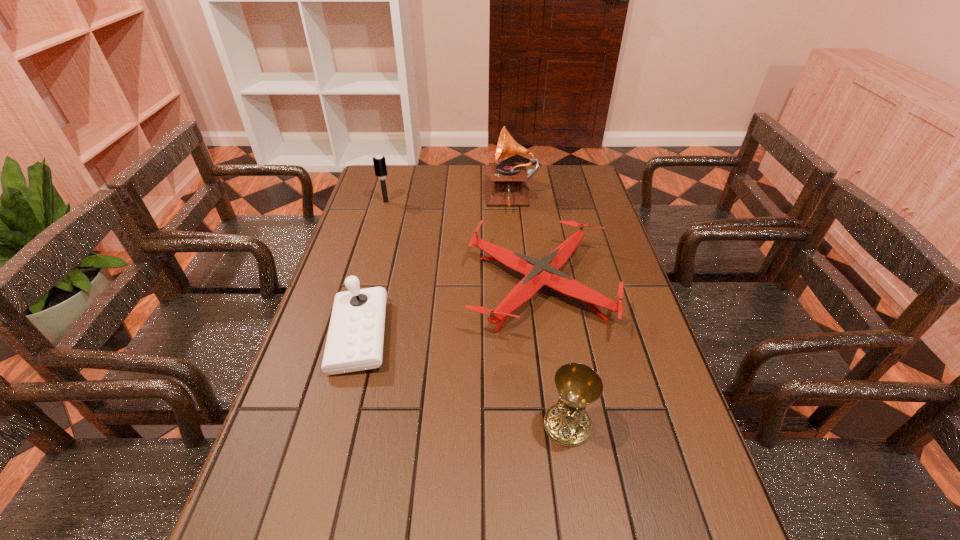
Identify the location of the tallest object. (507, 187).

The image size is (960, 540). In order to click on hairbrush in this screenshot , I will do `click(379, 162)`.

Where is `chalice`? The height and width of the screenshot is (540, 960). chalice is located at coordinates (567, 423).

Where is `joystick`? joystick is located at coordinates (355, 337).

This screenshot has height=540, width=960. I want to click on drone, so click(x=538, y=273).

Locate an element on the screen. The image size is (960, 540). vacant space located on the horn of the tallest object is located at coordinates (426, 200).

The width and height of the screenshot is (960, 540). Find the location of `vacant space situated 0.060m on the horn of the tallest object`. vacant space situated 0.060m on the horn of the tallest object is located at coordinates (470, 200).

You are a GUI agent. You are given a task and a screenshot of the screen. Output one action in this format:
    pyautogui.click(x=<x>, y=<y>)
    Task: Click on the vacant space located on the horn of the tallest object
    
    Given the screenshot: What is the action you would take?
    pyautogui.click(x=432, y=200)

You are a GUI agent. You are given a task and a screenshot of the screen. Output one action in this format:
    pyautogui.click(x=<x>, y=<y>)
    Task: Click on the vacant area situated 0.070m on the left of the hairbrush
    
    Given the screenshot: What is the action you would take?
    pyautogui.click(x=360, y=202)

This screenshot has height=540, width=960. In order to click on vacant space located 0.280m on the back of the fifth farthest object in this screenshot , I will do `click(549, 313)`.